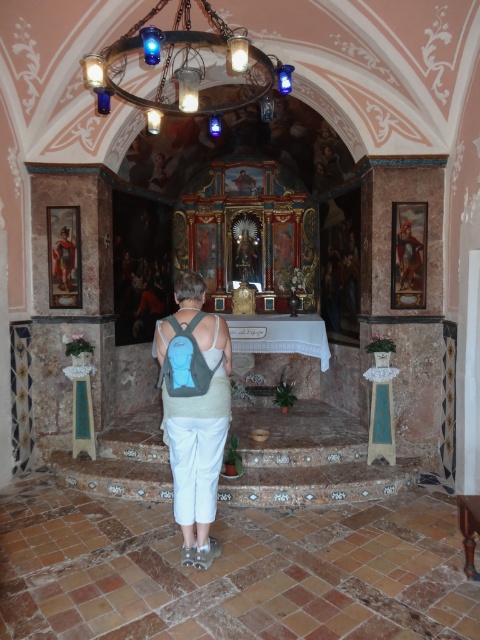
Question: Which object is positioned farthest from the gray fabric backpack at center?

Choices:
 (A) matte gold statue at left
 (B) metallic ring at upper center

Answer: (A)

Question: Is metallic ring at upper center smaller than matte gold statue at left?

Choices:
 (A) no
 (B) yes

Answer: (A)

Question: Which object is farther from the camera taking this photo?

Choices:
 (A) metallic ring at upper center
 (B) gray fabric backpack at center
 (C) matte gold statue at left

Answer: (C)

Question: Which point is closer to the camera?

Choices:
 (A) matte gold statue at left
 (B) gray fabric backpack at center
 (C) metallic ring at upper center

Answer: (C)

Question: Where is metallic ring at upper center located in relation to gray fabric backpack at center in the image?

Choices:
 (A) above
 (B) below

Answer: (A)

Question: Does metallic ring at upper center lie behind gray fabric backpack at center?

Choices:
 (A) yes
 (B) no

Answer: (B)